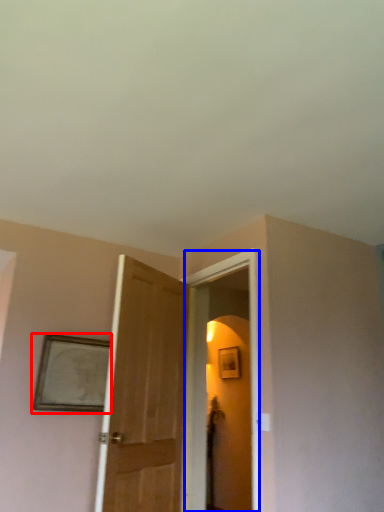
Question: Which of the following is the closest to the observer, picture frame (highlighted by a red box) or screen door (highlighted by a blue box)?

Choices:
 (A) picture frame
 (B) screen door

Answer: (B)